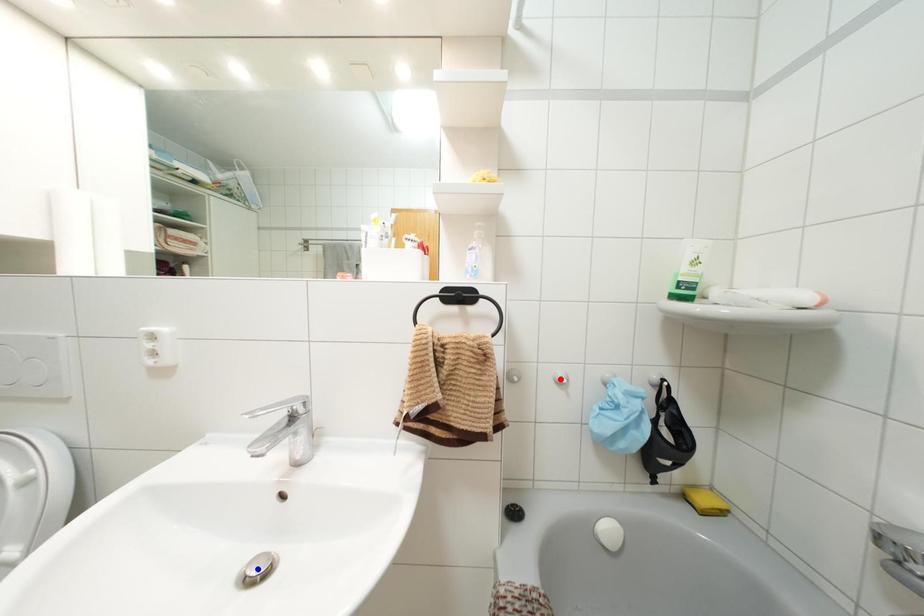
Question: Which of the two points in the image is closer to the camera?

Choices:
 (A) Blue point is closer.
 (B) Red point is closer.

Answer: (A)